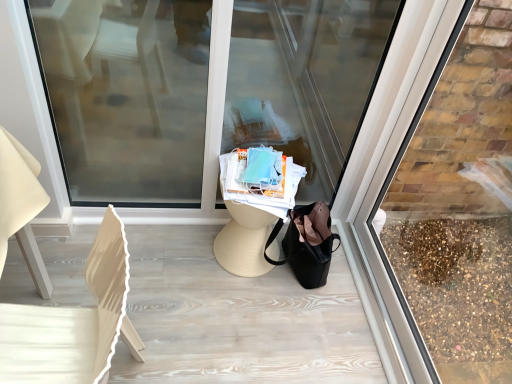
Question: Does transparent glass shop window at center, marked as the 1th shop window in a left-to-right arrangement, have a lesser height compared to white wood chair at left?

Choices:
 (A) no
 (B) yes

Answer: (A)

Question: Does transparent glass shop window at center, marked as the 1th shop window in a left-to-right arrangement, have a larger size compared to white wood chair at left?

Choices:
 (A) yes
 (B) no

Answer: (B)

Question: Does transparent glass shop window at center, marked as the 1th shop window in a left-to-right arrangement, have a smaller size compared to white wood chair at left?

Choices:
 (A) yes
 (B) no

Answer: (A)

Question: Considering the relative positions of transparent glass shop window at center, the second shop window positioned from the right, and white wood chair at left in the image provided, is transparent glass shop window at center, the second shop window positioned from the right, in front of white wood chair at left?

Choices:
 (A) no
 (B) yes

Answer: (A)

Question: Is transparent glass shop window at center, marked as the 1th shop window in a left-to-right arrangement, thinner than white wood chair at left?

Choices:
 (A) no
 (B) yes

Answer: (B)

Question: Considering their positions, is white wood chair at left located in front of or behind transparent glass at right, which ranks as the 2th shop window in left-to-right order?

Choices:
 (A) front
 (B) behind

Answer: (B)

Question: Based on their positions, is white wood chair at left located to the left or right of transparent glass at right, which ranks as the 2th shop window in left-to-right order?

Choices:
 (A) right
 (B) left

Answer: (B)

Question: Based on their sizes in the image, would you say white wood chair at left is bigger or smaller than transparent glass at right, the first shop window in the right-to-left sequence?

Choices:
 (A) big
 (B) small

Answer: (A)

Question: From the image's perspective, is white wood chair at left above or below transparent glass at right, the first shop window in the right-to-left sequence?

Choices:
 (A) above
 (B) below

Answer: (B)

Question: From the image's perspective, is transparent glass shop window at center, the second shop window positioned from the right, positioned above or below transparent glass at right, the first shop window in the right-to-left sequence?

Choices:
 (A) above
 (B) below

Answer: (A)

Question: Does point (161, 74) appear closer or farther from the camera than point (476, 248)?

Choices:
 (A) farther
 (B) closer

Answer: (B)

Question: Is transparent glass shop window at center, the second shop window positioned from the right, taller or shorter than transparent glass at right, the first shop window in the right-to-left sequence?

Choices:
 (A) short
 (B) tall

Answer: (A)

Question: Based on their sizes in the image, would you say transparent glass shop window at center, the second shop window positioned from the right, is bigger or smaller than transparent glass at right, which ranks as the 2th shop window in left-to-right order?

Choices:
 (A) small
 (B) big

Answer: (B)

Question: Considering the relative positions of transparent glass shop window at center, marked as the 1th shop window in a left-to-right arrangement, and white wood chair at left in the image provided, is transparent glass shop window at center, marked as the 1th shop window in a left-to-right arrangement, to the left or to the right of white wood chair at left?

Choices:
 (A) right
 (B) left

Answer: (A)

Question: Considering the positions of transparent glass shop window at center, marked as the 1th shop window in a left-to-right arrangement, and white wood chair at left in the image, is transparent glass shop window at center, marked as the 1th shop window in a left-to-right arrangement, bigger or smaller than white wood chair at left?

Choices:
 (A) big
 (B) small

Answer: (B)